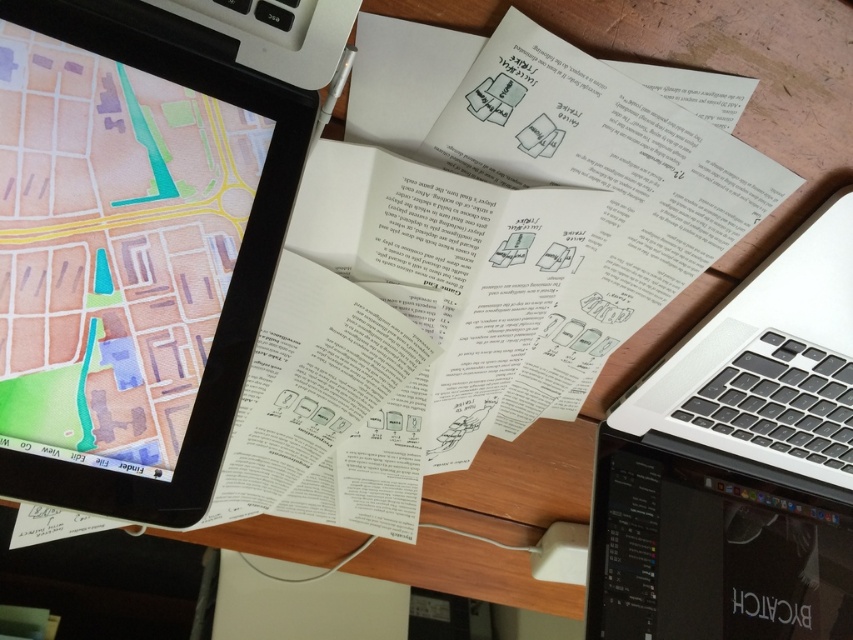
You are a delivery person who needs to determine the shortest path between two points on the map displayed on the left laptop. The points are labeled as point 1 at coordinates (44, 195) and point 2 at coordinates (718, 445). Based on their positions on the map, which point is closer to the starting location of the delivery route?

Point 1 at coordinates (44, 195) is closer to the starting location because it is closer to the viewer than point 2 at coordinates (718, 445).

You are organizing the cables on the desk. There are two points marked on the desk where cables are plugged in. The first point is at coordinates point (776, 595) and the second point is at coordinates point (814, 349). From your vantage point, which point is closer to you?

Point (814, 349) is closer to you because it is in front of point (776, 595) according to their spatial arrangement.

You are organizing a presentation and need to choose between the black glossy tablet at upper left and the black glossy tablet at lower right for a slide. Which tablet has a smaller width?

The black glossy tablet at upper left has a smaller width compared to the black glossy tablet at lower right.